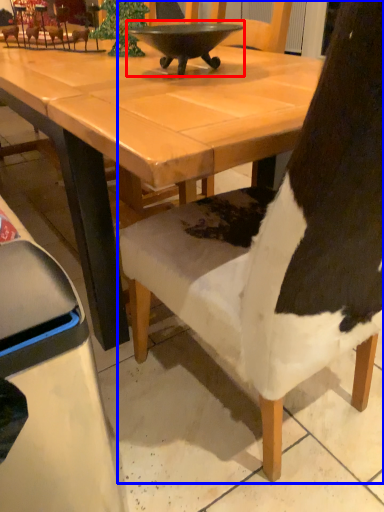
Question: Among these objects, which one is nearest to the camera, bowl (highlighted by a red box) or chair (highlighted by a blue box)?

Choices:
 (A) bowl
 (B) chair

Answer: (B)